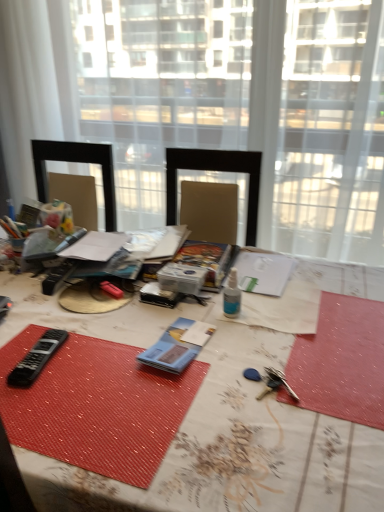
At what (x,y) coordinates should I click in order to perform the action: click on free location in front of black plastic remote at lower left, the first equipment from the left. Please return your answer as a coordinate pair (x, y). Looking at the image, I should click on (46, 413).